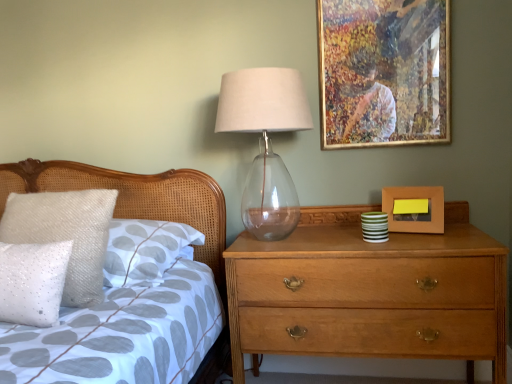
Question: Does wooden picture frame at right, arranged as the 2th picture frame when viewed from the top, come behind gold-framed artwork at upper right, arranged as the 1th picture frame when viewed from the top?

Choices:
 (A) yes
 (B) no

Answer: (B)

Question: Considering the relative sizes of wooden picture frame at right, arranged as the 2th picture frame when viewed from the top, and gold-framed artwork at upper right, arranged as the 1th picture frame when viewed from the top, in the image provided, is wooden picture frame at right, arranged as the 2th picture frame when viewed from the top, bigger than gold-framed artwork at upper right, arranged as the 1th picture frame when viewed from the top,?

Choices:
 (A) yes
 (B) no

Answer: (B)

Question: Does wooden picture frame at right, which is the 1th picture frame in bottom-to-top order, have a greater width compared to gold-framed artwork at upper right, arranged as the 1th picture frame when viewed from the top?

Choices:
 (A) yes
 (B) no

Answer: (A)

Question: Is wooden picture frame at right, arranged as the 2th picture frame when viewed from the top, next to gold-framed artwork at upper right, which ranks as the 2th picture frame in bottom-to-top order, and touching it?

Choices:
 (A) no
 (B) yes

Answer: (A)

Question: Are wooden picture frame at right, which is the 1th picture frame in bottom-to-top order, and gold-framed artwork at upper right, arranged as the 1th picture frame when viewed from the top, far apart?

Choices:
 (A) no
 (B) yes

Answer: (A)

Question: From a real-world perspective, is wooden picture frame at right, which is the 1th picture frame in bottom-to-top order, physically located above or below light brown wooden chest of drawers at right?

Choices:
 (A) above
 (B) below

Answer: (A)

Question: From the image's perspective, is wooden picture frame at right, arranged as the 2th picture frame when viewed from the top, located above or below light brown wooden chest of drawers at right?

Choices:
 (A) below
 (B) above

Answer: (B)

Question: Would you say wooden picture frame at right, which is the 1th picture frame in bottom-to-top order, is to the left or to the right of light brown wooden chest of drawers at right in the picture?

Choices:
 (A) right
 (B) left

Answer: (A)

Question: Considering the positions of wooden picture frame at right, which is the 1th picture frame in bottom-to-top order, and light brown wooden chest of drawers at right in the image, is wooden picture frame at right, which is the 1th picture frame in bottom-to-top order, taller or shorter than light brown wooden chest of drawers at right?

Choices:
 (A) tall
 (B) short

Answer: (B)

Question: Looking at the image, does transparent glass table lamp at upper center seem bigger or smaller compared to wooden picture frame at right, arranged as the 2th picture frame when viewed from the top?

Choices:
 (A) small
 (B) big

Answer: (B)

Question: Looking at their shapes, would you say transparent glass table lamp at upper center is wider or thinner than wooden picture frame at right, arranged as the 2th picture frame when viewed from the top?

Choices:
 (A) wide
 (B) thin

Answer: (A)

Question: Considering the positions of transparent glass table lamp at upper center and wooden picture frame at right, arranged as the 2th picture frame when viewed from the top, in the image, is transparent glass table lamp at upper center taller or shorter than wooden picture frame at right, arranged as the 2th picture frame when viewed from the top,?

Choices:
 (A) tall
 (B) short

Answer: (A)

Question: Considering the positions of point (298, 125) and point (400, 221), is point (298, 125) closer or farther from the camera than point (400, 221)?

Choices:
 (A) closer
 (B) farther

Answer: (A)

Question: Is point (16, 296) closer or farther from the camera than point (96, 201)?

Choices:
 (A) closer
 (B) farther

Answer: (A)

Question: Based on their sizes in the image, would you say white sequined pillow at left, which is the 1th pillow in front-to-back order, is bigger or smaller than white sequined pillow at left, which is the 2th pillow from front to back?

Choices:
 (A) big
 (B) small

Answer: (B)